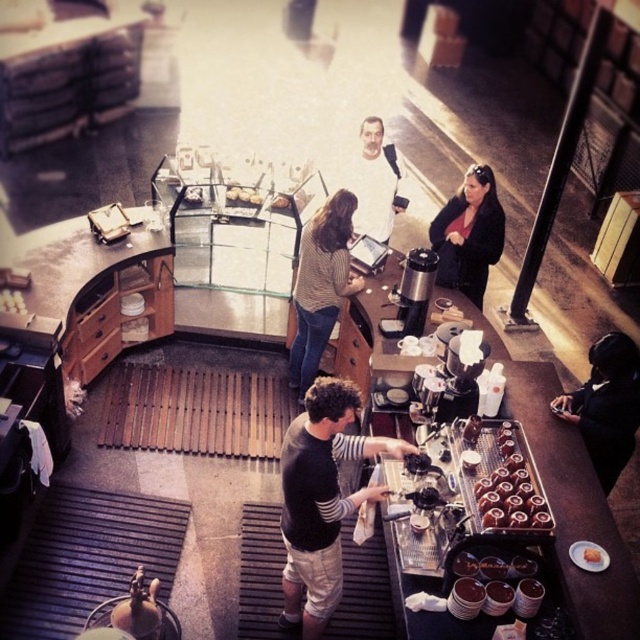
Question: Does striped sweater at center lie behind matte white plate at center?

Choices:
 (A) no
 (B) yes

Answer: (A)

Question: Which is nearer to the matte black jacket at upper right?

Choices:
 (A) black matte jacket at lower right
 (B) matte white plate at center
 (C) golden brown pastry at center

Answer: (A)

Question: Among these points, which one is nearest to the camera?

Choices:
 (A) (596, 563)
 (B) (244, 200)

Answer: (A)

Question: Estimate the real-world distances between objects in this image. Which object is farther from the matte white plate at center?

Choices:
 (A) matte black jacket at upper right
 (B) striped sweater at center
 (C) dark gray shirt at center
 (D) golden brown pastry at center

Answer: (D)

Question: Considering the relative positions of chocolate frosted donuts at center and golden brown pastry at center in the image provided, where is chocolate frosted donuts at center located with respect to golden brown pastry at center?

Choices:
 (A) left
 (B) right

Answer: (A)

Question: Is dark gray shirt at center above striped sweater at center?

Choices:
 (A) no
 (B) yes

Answer: (A)